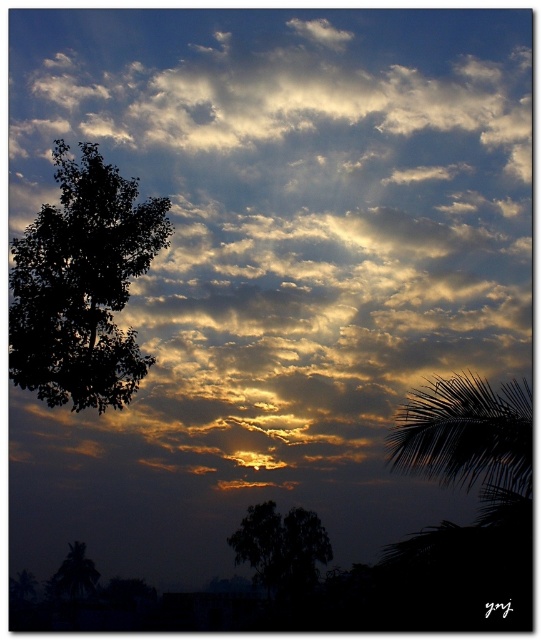
Between dark green leafy tree at left and dark green leafy tree at center, which one appears on the right side from the viewer's perspective?

dark green leafy tree at center

Which is above, dark green leafy tree at left or dark green leafy tree at center?

Positioned higher is dark green leafy tree at left.

Between point (96, 397) and point (298, 513), which one is positioned behind?

The point (298, 513) is behind.

Find the location of a particular element. The height and width of the screenshot is (640, 541). dark green leafy tree at left is located at coordinates tap(82, 284).